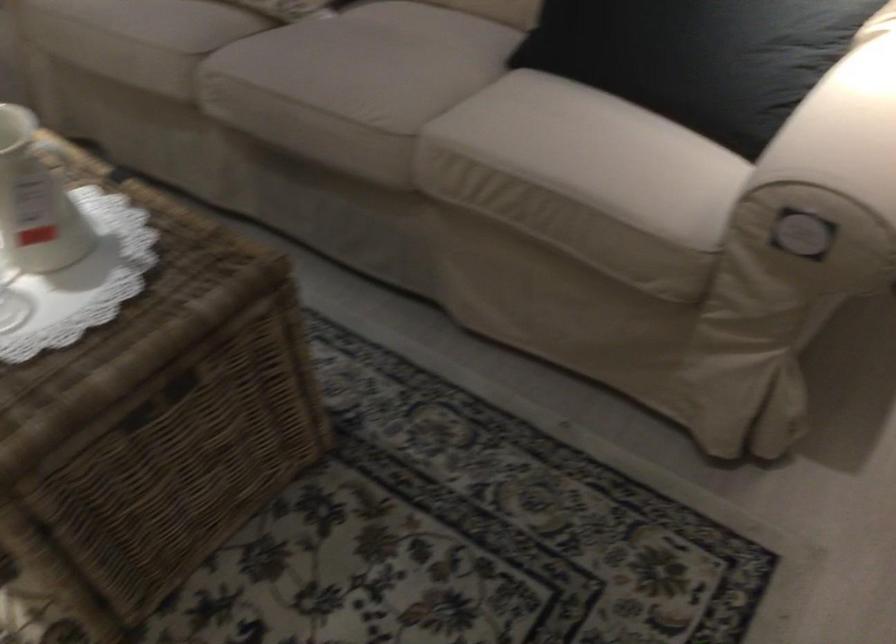
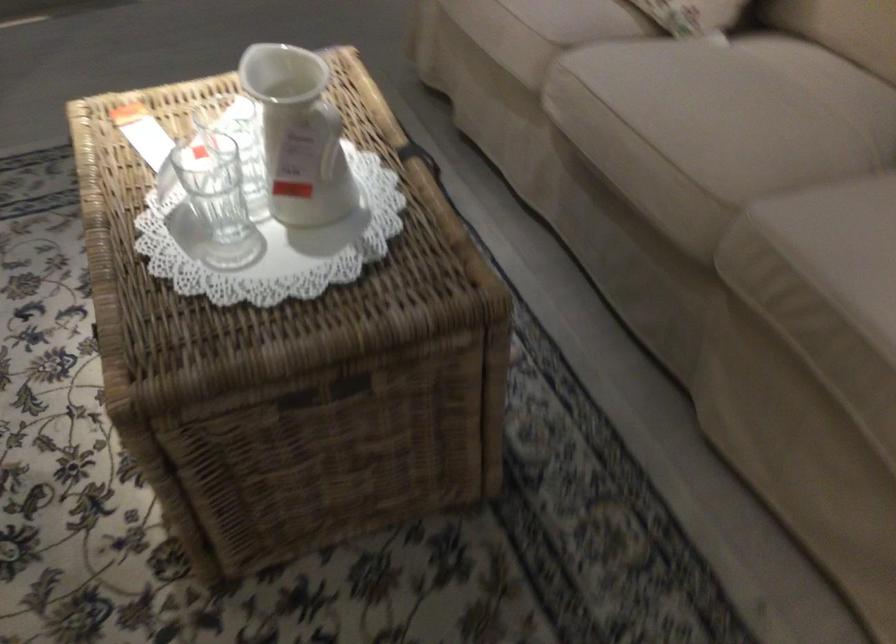
Locate, in the second image, the point that corresponds to the point at 376,115 in the first image.

(704, 167)